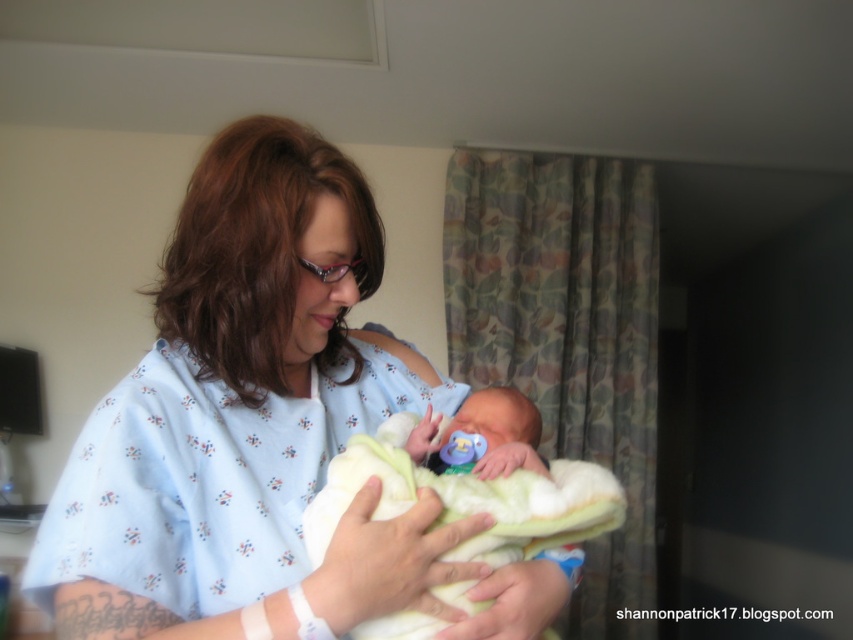
You are a nurse in a hospital room and need to determine which item is bigger between the blue floral hospital gown at center and the white soft blanket at center. Which one is larger?

The blue floral hospital gown at center has a larger size compared to the white soft blanket at center, so the blue floral hospital gown at center is larger.

In the hospital room scene, you see a woman wearing the blue floral hospital gown at center and holding the smooth white blanket at center. Which item is located more to the left?

The blue floral hospital gown at center is positioned on the left side of the smooth white blanket at center, so it is more to the left.

You are a nurse in a hospital room and need to locate the blue floral hospital gown at center. Based on the coordinate system where the bottom left corner is the origin, can you determine if the gown is closer to the top or bottom of the room?

The blue floral hospital gown at center is located at position point (258, 428). Since the y coordinate 0.304 is closer to 0.5 than to 0, the gown is closer to the center of the room vertically. However, since the question asks whether it is closer to the top or bottom, we can compare it to the halfway point. The halfway point between the bottom and top is 0.5. The distance from 0.304 to 0.5 is 0.196, while the distance from 0.304 to the bottom at 0 is 0.304. Since 0.196 is less than 0.304, the gown is 0.